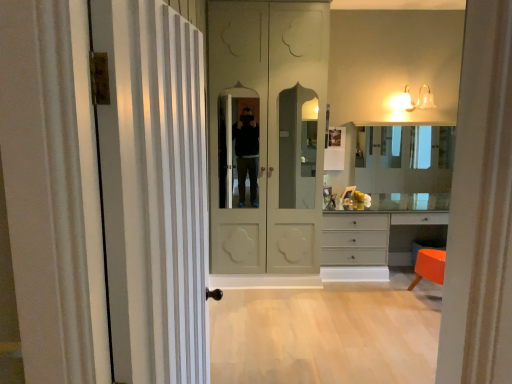
You are a GUI agent. You are given a task and a screenshot of the screen. Output one action in this format:
    pyautogui.click(x=<x>, y=<y>)
    Task: Click on the free space in front of matte cream door at center, which appears as the second door when viewed from the front
    
    Given the screenshot: What is the action you would take?
    pyautogui.click(x=282, y=317)